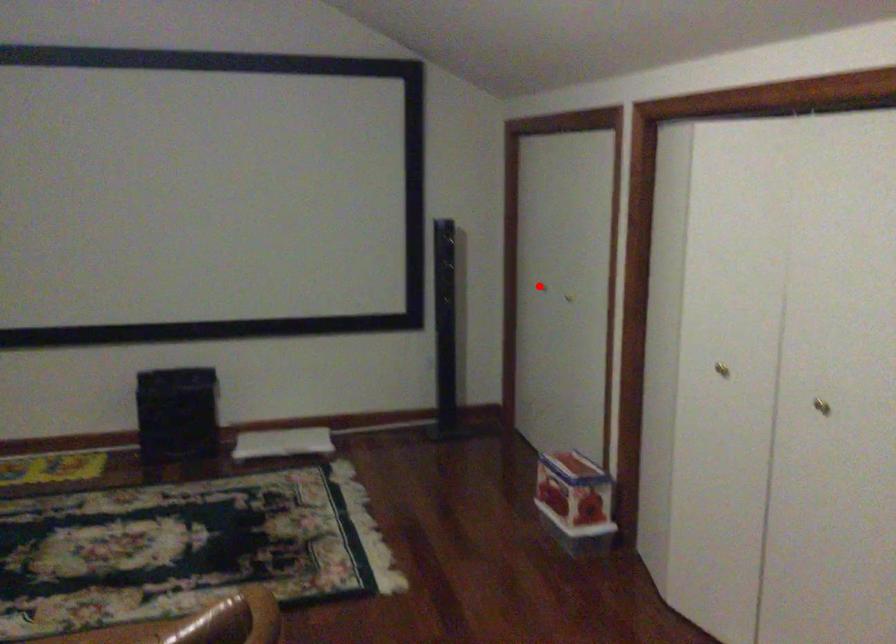
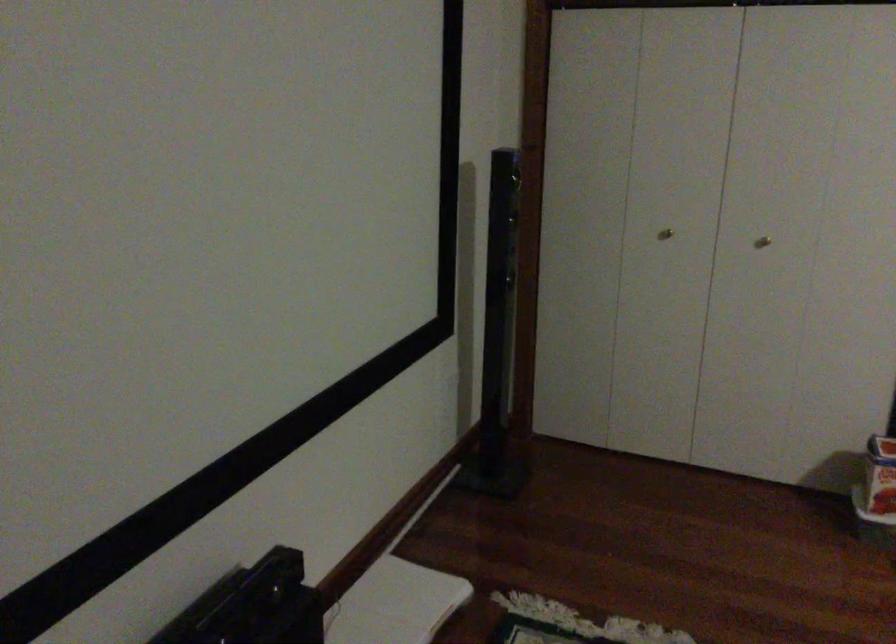
The point at the highlighted location is marked in the first image. Where is the corresponding point in the second image?

(665, 234)